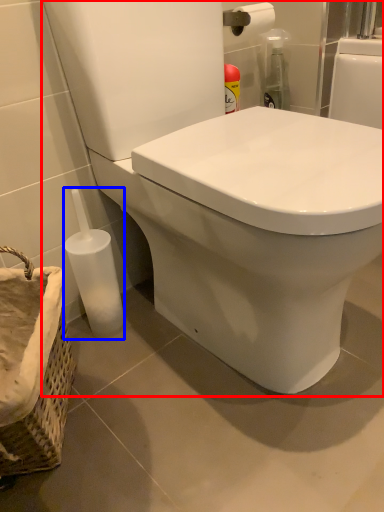
Question: Among these objects, which one is farthest to the camera, toilet (highlighted by a red box) or bottle (highlighted by a blue box)?

Choices:
 (A) toilet
 (B) bottle

Answer: (B)